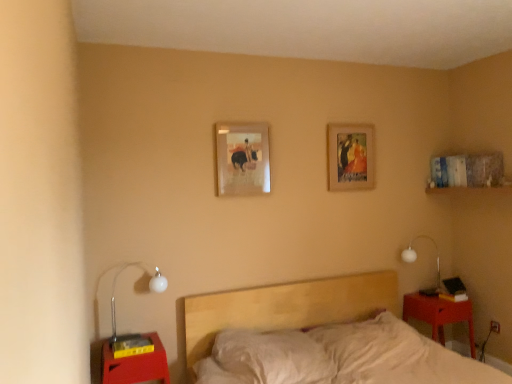
At what (x,y) coordinates should I click in order to perform the action: click on free region under white glass lamp at right, which ranks as the second lamp in front-to-back order (from a real-world perspective). Please return your answer as a coordinate pair (x, y). The height and width of the screenshot is (384, 512). Looking at the image, I should click on (420, 295).